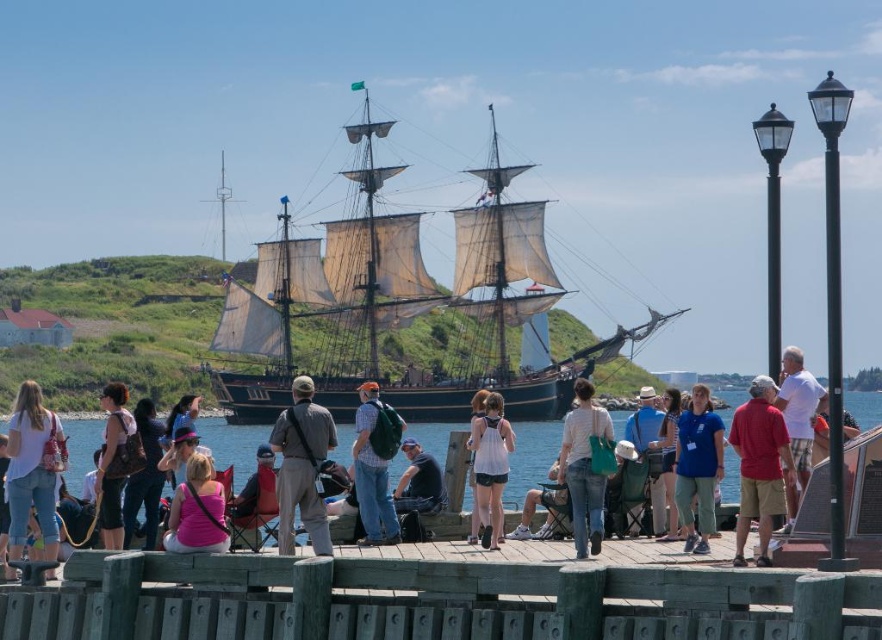
You are standing on the green wood dock at center and want to throw a small ball to someone wearing the dark gray fabric jacket at center. If the ball can travel up to 80 feet, will it reach them?

The distance between the green wood dock at center and the dark gray fabric jacket at center is 85.47 feet, which is greater than the ball can travel. Therefore, the ball will not reach them.

You are standing on the wooden dock and see the denim jeans at center and the matte brown backpack at center. Which object is positioned to the right side?

The denim jeans at center is to the right of the matte brown backpack at center.